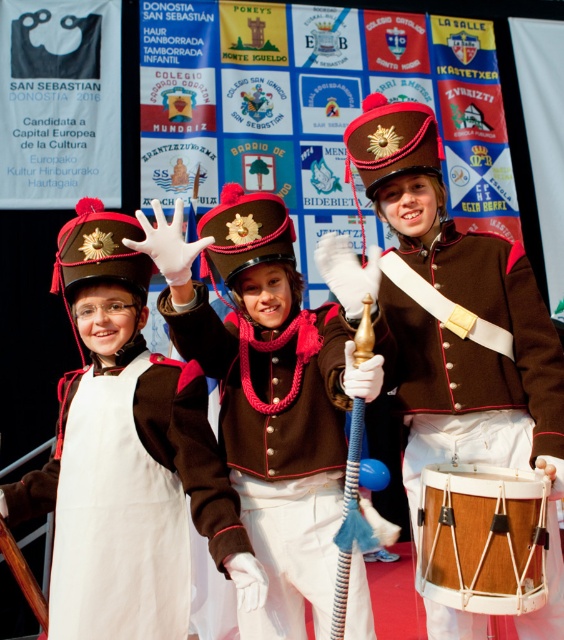
You are a photographer standing 20 inches away from the brown woolen jacket at center and the wooden drum at center. Can you fit both objects into your camera frame if your camera has a maximum capture width of 20 inches?

The distance between the brown woolen jacket at center and the wooden drum at center is 15.42 inches, which is less than the camera frame width of 20 inches. Therefore, both objects can be captured within the frame.

You are a photographer setting up for a group photo. The wooden drum at center and the white felt dress at center are part of the scene. If your camera can capture objects within a 20 inch radius, will both items be in frame?

The distance between the wooden drum at center and white felt dress at center is 22.72 inches. Since the camera can only capture objects within a 20 inch radius, the two items are slightly out of the camera frame.

You are a photographer at the event and need to ensure proper lighting for the subjects. Given that the brown matte uniform at center reflects less light than the white felt dress at center, which object requires more careful lighting adjustments to avoid overexposure?

The white felt dress at center requires more careful lighting adjustments because it reflects more light and is more prone to overexposure compared to the brown matte uniform at center.